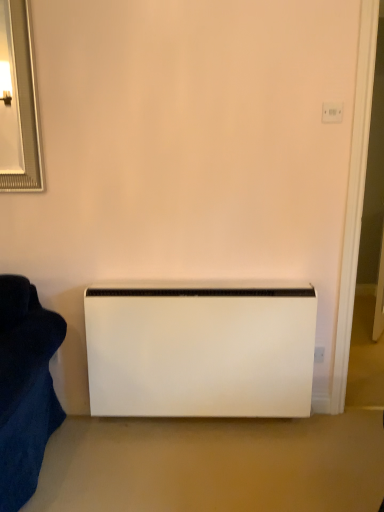
The image size is (384, 512). Identify the location of vacant location below white matte heater at center (from a real-world perspective). (194, 423).